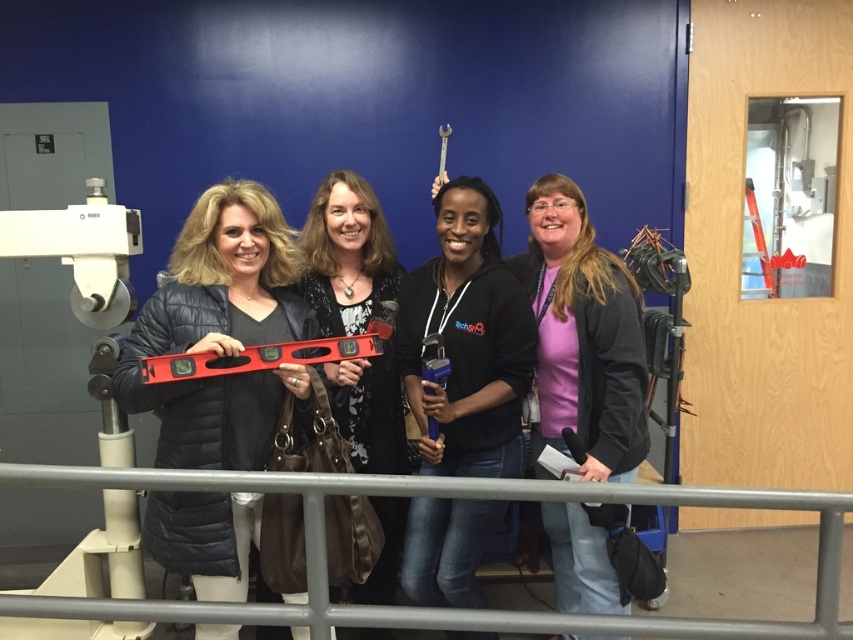
You are a photographer setting up for a group photo. You notice two levels in the scene. The matte black level at center and the blue plastic level at center. Which one is positioned lower in the image?

The matte black level at center is located below the blue plastic level at center, so it is positioned lower in the image.

You are organizing a tool display and need to place the pink matte shirt at center and the blue plastic level at center on a shelf. If the shelf has limited space, which object should you prioritize placing first based on their sizes?

The pink matte shirt at center is larger in size than the blue plastic level at center, so you should prioritize placing the pink matte shirt at center first to ensure it fits on the shelf.